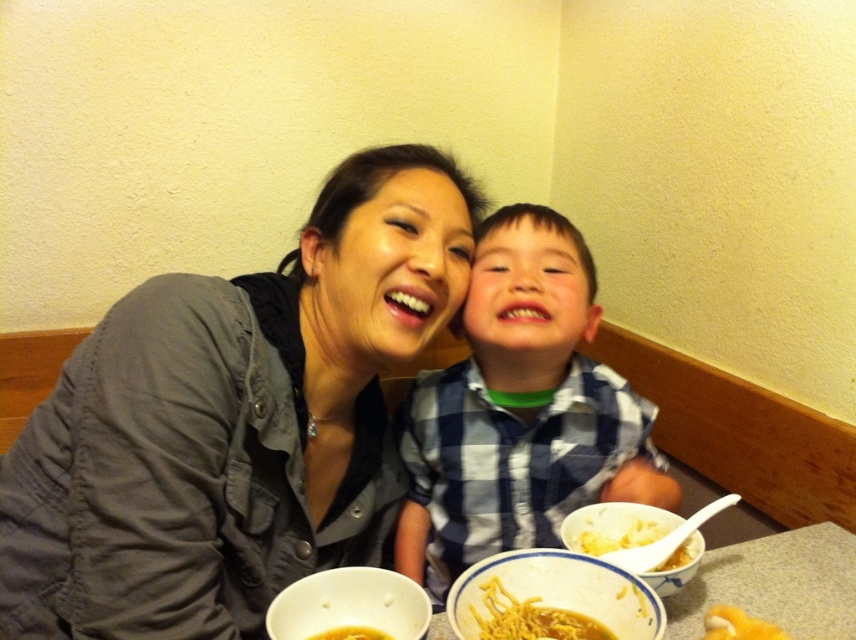
You are a photographer trying to capture a candid shot of the scene. You notice the denim jacket at center and the white ceramic bowl at lower right. Which object should you focus on first if you want to ensure both are in sharp focus?

The denim jacket at center is closer to the viewer than the white ceramic bowl at lower right. To ensure both are in sharp focus, focus on the denim jacket at center first, as it is closer, and use a smaller aperture to maximize depth of field.

You are a chef preparing a meal and need to place the white ceramic bowl at lower right on top of the denim jacket at center. Is this possible based on their sizes?

The denim jacket at center is much taller than the white ceramic bowl at lower right, so placing the white ceramic bowl at lower right on top of the denim jacket at center should be possible as the jacket is taller.